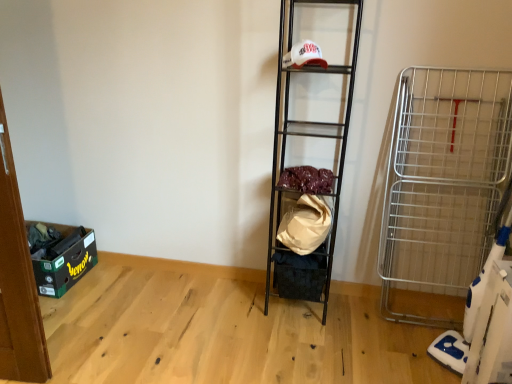
Identify the location of vacant space situated on the left part of silver metallic cart at right. The height and width of the screenshot is (384, 512). (401, 354).